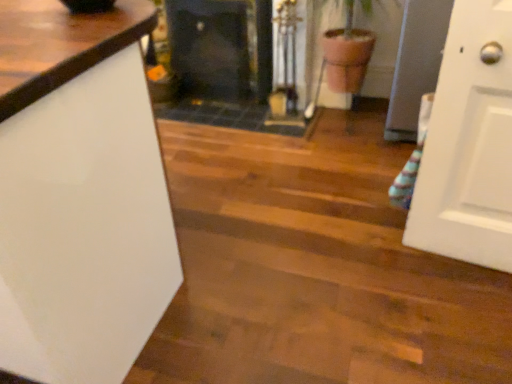
Question: Which direction should I rotate to look at black glass fireplace at center, which ranks as the first fireplace in left-to-right order, — up or down?

Choices:
 (A) up
 (B) down

Answer: (A)

Question: Does black glass fireplace at center, the second fireplace viewed from the left, have a greater height compared to white glossy countertop at left?

Choices:
 (A) no
 (B) yes

Answer: (A)

Question: From a real-world perspective, is black glass fireplace at center, the 1th fireplace from the right, on top of white glossy countertop at left?

Choices:
 (A) no
 (B) yes

Answer: (A)

Question: Can you confirm if black glass fireplace at center, the second fireplace viewed from the left, is shorter than white glossy countertop at left?

Choices:
 (A) yes
 (B) no

Answer: (A)

Question: Is black glass fireplace at center, the 1th fireplace from the right, further to the viewer compared to white glossy countertop at left?

Choices:
 (A) no
 (B) yes

Answer: (B)

Question: Is black glass fireplace at center, the 1th fireplace from the right, at the right side of white glossy countertop at left?

Choices:
 (A) yes
 (B) no

Answer: (A)

Question: Is black glass fireplace at center, the second fireplace viewed from the left, at the left side of white glossy countertop at left?

Choices:
 (A) no
 (B) yes

Answer: (A)

Question: Are white glossy countertop at left and black glass fireplace at center, which ranks as the first fireplace in left-to-right order, located far from each other?

Choices:
 (A) yes
 (B) no

Answer: (A)

Question: From the image's perspective, does white glossy countertop at left appear lower than black glass fireplace at center, which ranks as the first fireplace in left-to-right order?

Choices:
 (A) no
 (B) yes

Answer: (B)

Question: Is the depth of white glossy countertop at left greater than that of black glass fireplace at center, which ranks as the first fireplace in left-to-right order?

Choices:
 (A) yes
 (B) no

Answer: (B)

Question: Is white glossy countertop at left not inside black glass fireplace at center, which ranks as the first fireplace in left-to-right order?

Choices:
 (A) no
 (B) yes

Answer: (B)

Question: From the image's perspective, would you say white glossy countertop at left is positioned over black glass fireplace at center, arranged as the 2th fireplace when viewed from the right?

Choices:
 (A) yes
 (B) no

Answer: (B)

Question: Is white glossy countertop at left positioned in front of black glass fireplace at center, which ranks as the first fireplace in left-to-right order?

Choices:
 (A) no
 (B) yes

Answer: (B)

Question: Does white glossy countertop at left have a larger size compared to black glass fireplace at center, the second fireplace viewed from the left?

Choices:
 (A) yes
 (B) no

Answer: (A)